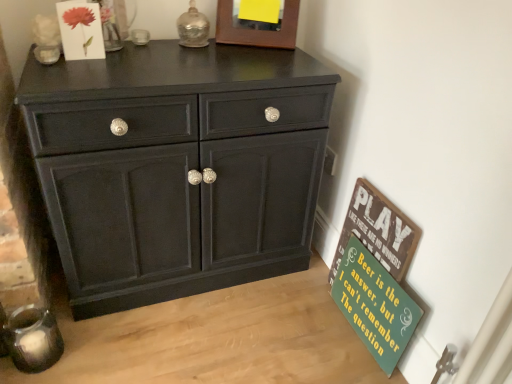
Question: From a real-world perspective, is matte paper flower at upper left under matte black cabinet at center?

Choices:
 (A) no
 (B) yes

Answer: (A)

Question: Is matte paper flower at upper left wider than matte black cabinet at center?

Choices:
 (A) yes
 (B) no

Answer: (B)

Question: Would you say matte paper flower at upper left is outside matte black cabinet at center?

Choices:
 (A) yes
 (B) no

Answer: (A)

Question: Can you confirm if matte paper flower at upper left is taller than matte black cabinet at center?

Choices:
 (A) no
 (B) yes

Answer: (A)

Question: Does matte paper flower at upper left appear on the right side of matte black cabinet at center?

Choices:
 (A) yes
 (B) no

Answer: (B)

Question: From a real-world perspective, is matte paper flower at upper left positioned over matte black cabinet at center based on gravity?

Choices:
 (A) yes
 (B) no

Answer: (A)

Question: Is wooden picture frame at upper center next to green wood signboard at lower right, the second bulletin board positioned from the top?

Choices:
 (A) yes
 (B) no

Answer: (B)

Question: Is wooden picture frame at upper center taller than green wood signboard at lower right, which is counted as the 1th bulletin board, starting from the bottom?

Choices:
 (A) no
 (B) yes

Answer: (A)

Question: Does wooden picture frame at upper center turn towards green wood signboard at lower right, which is counted as the 1th bulletin board, starting from the bottom?

Choices:
 (A) no
 (B) yes

Answer: (A)

Question: Is wooden picture frame at upper center outside green wood signboard at lower right, the second bulletin board positioned from the top?

Choices:
 (A) no
 (B) yes

Answer: (B)

Question: Is wooden picture frame at upper center turned away from green wood signboard at lower right, the second bulletin board positioned from the top?

Choices:
 (A) yes
 (B) no

Answer: (B)

Question: From the image's perspective, is wooden picture frame at upper center located above green wood signboard at lower right, the second bulletin board positioned from the top?

Choices:
 (A) no
 (B) yes

Answer: (B)

Question: Is green painted wood signboard at lower right, placed as the second bulletin board when sorted from bottom to top, at the left side of green wood signboard at lower right, the second bulletin board positioned from the top?

Choices:
 (A) no
 (B) yes

Answer: (B)